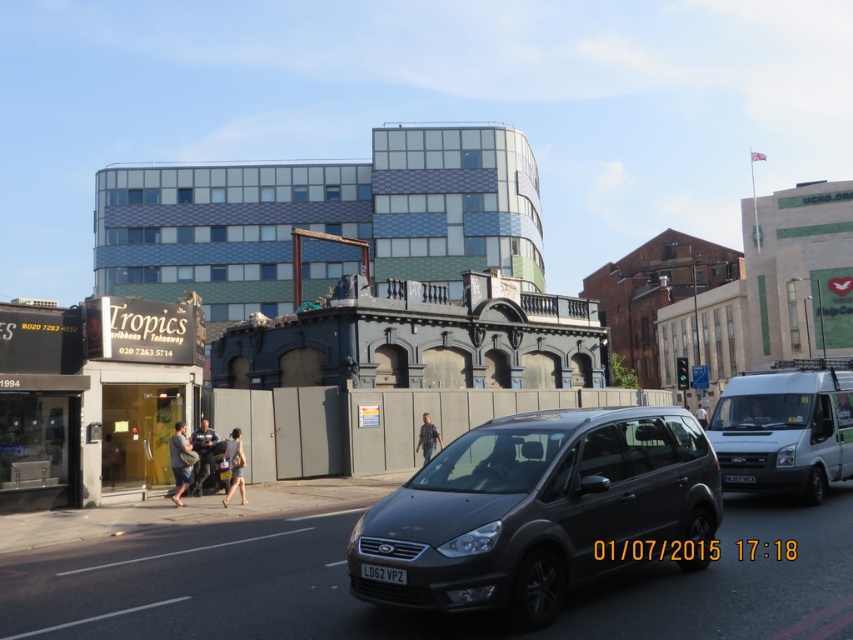
This screenshot has width=853, height=640. Describe the element at coordinates (538, 512) in the screenshot. I see `matte black van at center` at that location.

Who is positioned more to the left, matte black van at center or white matte van at right?

Positioned to the left is matte black van at center.

Is point (714, 468) farther from camera compared to point (820, 470)?

No.

This screenshot has height=640, width=853. Find the location of `matte black van at center`. matte black van at center is located at coordinates (538, 512).